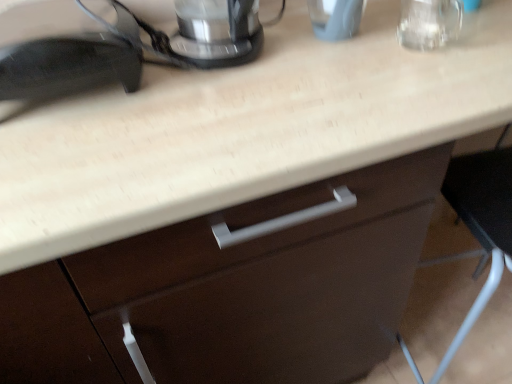
This screenshot has width=512, height=384. I want to click on sleek metallic coffee pot at upper center, so click(x=219, y=32).

What do you see at coordinates (219, 32) in the screenshot? I see `sleek metallic coffee pot at upper center` at bounding box center [219, 32].

This screenshot has height=384, width=512. Identify the location of sleek metallic coffee pot at upper center. (219, 32).